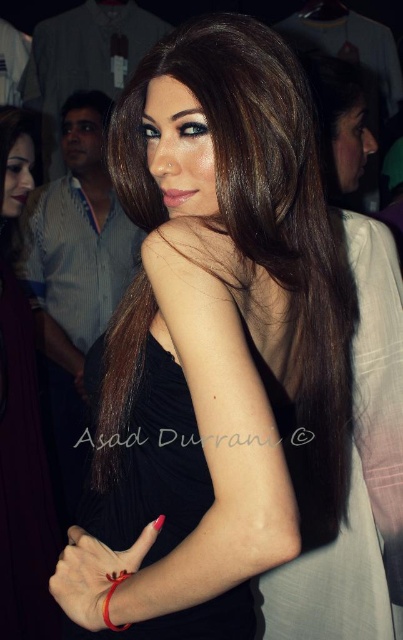
Looking at this image, does black matte dress at center appear over gold metallic bracelet at center?

Indeed, black matte dress at center is positioned over gold metallic bracelet at center.

Is the position of black matte dress at center less distant than that of gold metallic bracelet at center?

No, it is not.

You are a GUI agent. You are given a task and a screenshot of the screen. Output one action in this format:
    pyautogui.click(x=<x>, y=<y>)
    Task: Click on the black matte dress at center
    
    Given the screenshot: What is the action you would take?
    pyautogui.click(x=22, y=417)

Where is `black matte dress at center`? Image resolution: width=403 pixels, height=640 pixels. black matte dress at center is located at coordinates (22, 417).

How far apart are red matte bracelet at lower left and gold metallic bracelet at center?

4.25 centimeters

Does red matte bracelet at lower left appear under gold metallic bracelet at center?

No, red matte bracelet at lower left is not below gold metallic bracelet at center.

Is point (81, 564) closer to viewer compared to point (105, 625)?

No, it is not.

The image size is (403, 640). In order to click on red matte bracelet at lower left in this screenshot , I will do `click(105, 580)`.

Who is positioned more to the left, black matte dress at center or red matte bracelet at lower left?

From the viewer's perspective, black matte dress at center appears more on the left side.

Is black matte dress at center above red matte bracelet at lower left?

Yes, black matte dress at center is above red matte bracelet at lower left.

This screenshot has width=403, height=640. I want to click on black matte dress at center, so click(22, 417).